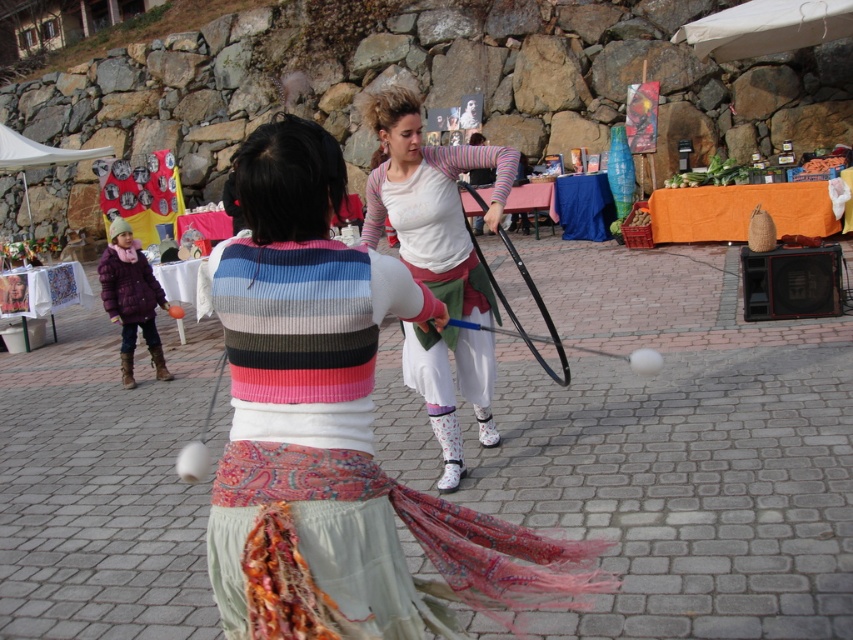
Question: Which of the following is the farthest from the observer?

Choices:
 (A) (508, 173)
 (B) (276, 330)
 (C) (138, 273)

Answer: (C)

Question: Can you confirm if white cotton shirt at center is wider than purple fuzzy coat at lower left?

Choices:
 (A) no
 (B) yes

Answer: (B)

Question: Which point is closer to the camera?

Choices:
 (A) (135, 241)
 (B) (270, 566)

Answer: (B)

Question: Is striped sweater at center smaller than purple fuzzy coat at lower left?

Choices:
 (A) yes
 (B) no

Answer: (B)

Question: Which of the following is the farthest from the observer?

Choices:
 (A) purple fuzzy coat at lower left
 (B) striped sweater at center

Answer: (A)

Question: Is striped sweater at center above purple fuzzy coat at lower left?

Choices:
 (A) yes
 (B) no

Answer: (B)